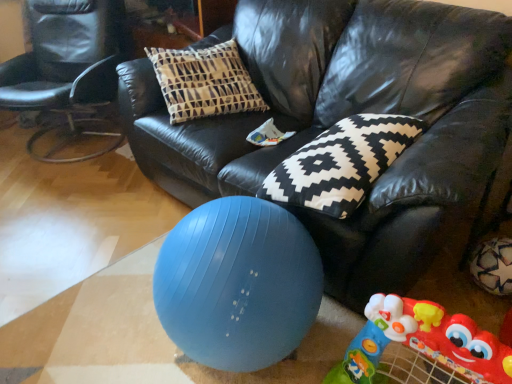
Question: Is black leather chair at left oriented away from black leather couch at center?

Choices:
 (A) no
 (B) yes

Answer: (A)

Question: From a real-world perspective, is black leather chair at left over black leather couch at center?

Choices:
 (A) no
 (B) yes

Answer: (A)

Question: Would you say black leather couch at center is part of black leather chair at left's contents?

Choices:
 (A) no
 (B) yes

Answer: (A)

Question: From a real-world perspective, is black leather chair at left below black leather couch at center?

Choices:
 (A) no
 (B) yes

Answer: (B)

Question: Considering the relative sizes of black leather chair at left and black leather couch at center in the image provided, is black leather chair at left wider than black leather couch at center?

Choices:
 (A) yes
 (B) no

Answer: (B)

Question: Would you consider black leather chair at left to be distant from black leather couch at center?

Choices:
 (A) no
 (B) yes

Answer: (B)

Question: Is rubberized plastic walker at lower right turned away from black leather couch at center?

Choices:
 (A) yes
 (B) no

Answer: (A)

Question: Can black leather couch at center be found inside rubberized plastic walker at lower right?

Choices:
 (A) no
 (B) yes

Answer: (A)

Question: Could you tell me if rubberized plastic walker at lower right is facing black leather couch at center?

Choices:
 (A) no
 (B) yes

Answer: (A)

Question: Considering the relative sizes of rubberized plastic walker at lower right and black leather couch at center in the image provided, is rubberized plastic walker at lower right taller than black leather couch at center?

Choices:
 (A) no
 (B) yes

Answer: (A)

Question: From a real-world perspective, is rubberized plastic walker at lower right below black leather couch at center?

Choices:
 (A) no
 (B) yes

Answer: (B)

Question: Can you confirm if rubberized plastic walker at lower right is positioned to the left of black leather couch at center?

Choices:
 (A) no
 (B) yes

Answer: (A)

Question: Does blue rubber ball at lower center have a smaller size compared to black leather chair at left?

Choices:
 (A) yes
 (B) no

Answer: (A)